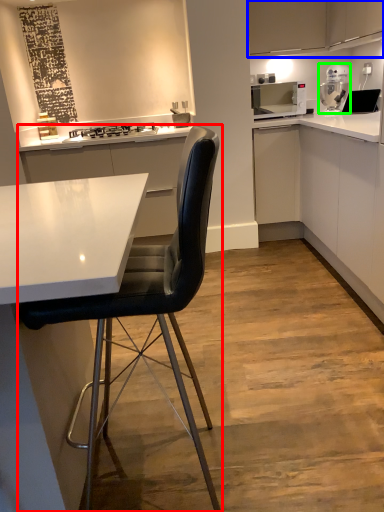
Question: Which object is the closest to the chair (highlighted by a red box)? Choose among these: cabinetry (highlighted by a blue box) or kitchen appliance (highlighted by a green box).

Choices:
 (A) cabinetry
 (B) kitchen appliance

Answer: (A)